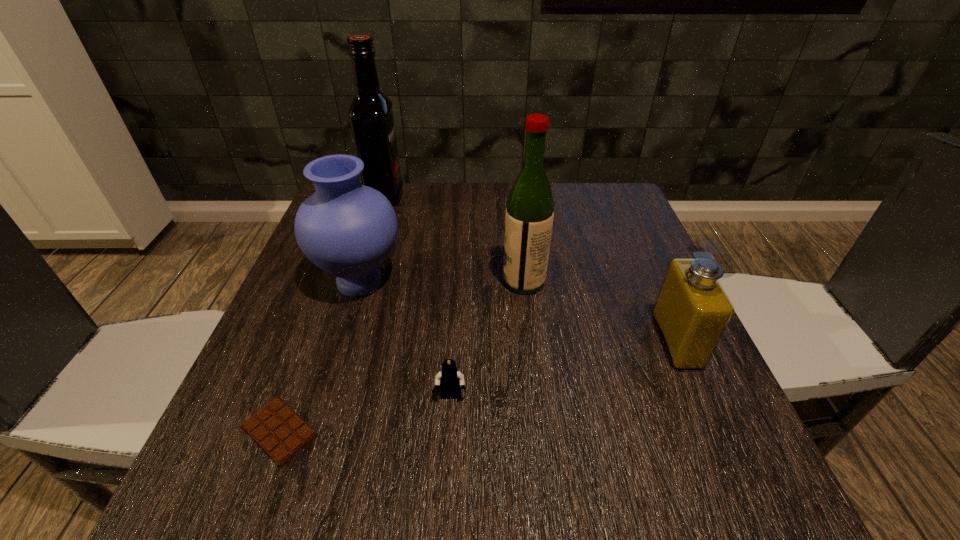
Image resolution: width=960 pixels, height=540 pixels. I want to click on the left liquor, so click(x=371, y=118).

This screenshot has height=540, width=960. Find the location of `the farthest object`. the farthest object is located at coordinates (371, 118).

Identify the location of the right liquor. The image size is (960, 540). (529, 216).

This screenshot has height=540, width=960. In order to click on the second object from right to left in this screenshot , I will do `click(529, 216)`.

Locate an element on the screen. the fourth shortest object is located at coordinates (346, 229).

You are a GUI agent. You are given a task and a screenshot of the screen. Output one action in this format:
    pyautogui.click(x=<x>, y=<y>)
    Task: Click on the third nearest object
    
    Given the screenshot: What is the action you would take?
    pyautogui.click(x=692, y=311)

This screenshot has width=960, height=540. Identify the location of the rightmost object. pyautogui.click(x=692, y=311).

At what (x,y) coordinates should I click in order to perform the action: click on Lego. Please return your answer as a coordinate pair (x, y). This screenshot has width=960, height=540. Looking at the image, I should click on (450, 379).

What are the coordinates of `the third object from right to left` in the screenshot? It's located at (450, 379).

Identify the location of candy bar. Image resolution: width=960 pixels, height=540 pixels. (279, 431).